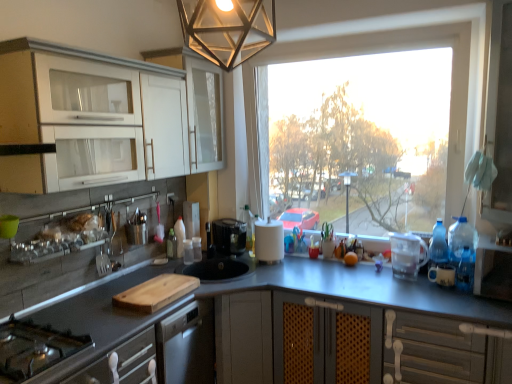
Where is `vacant area to the right of satin silver cutlery at left`? Image resolution: width=512 pixels, height=384 pixels. vacant area to the right of satin silver cutlery at left is located at coordinates (128, 279).